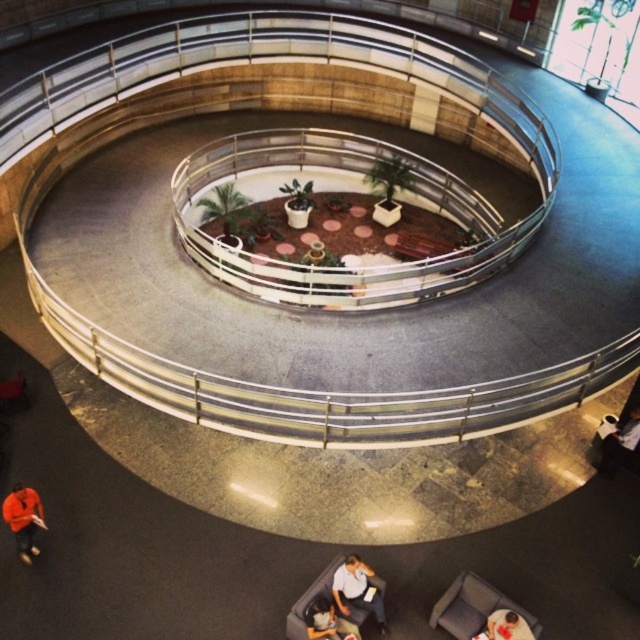
You are a guest in the atrium and want to sit down on the velvet blue couch at lower right. Is there enough space for your 1.5 meter wide suitcase next to the dark gray fabric jacket at lower right?

The velvet blue couch at lower right is larger in size than the dark gray fabric jacket at lower right, but the exact dimensions of the space between them are not provided. Therefore, it is uncertain if there is enough room for the 1.5 meter wide suitcase.

You are standing in the atrium and want to sit down on a bench that is 1.2 meters wide. There are two shirts in your view, the white fabric shirt at lower center and the orange shirt at lower center. Which shirt should you avoid sitting on if you need the widest possible space?

The white fabric shirt at lower center might be wider than the orange shirt at lower center, so you should avoid sitting on the orange shirt at lower center to have the widest possible space.